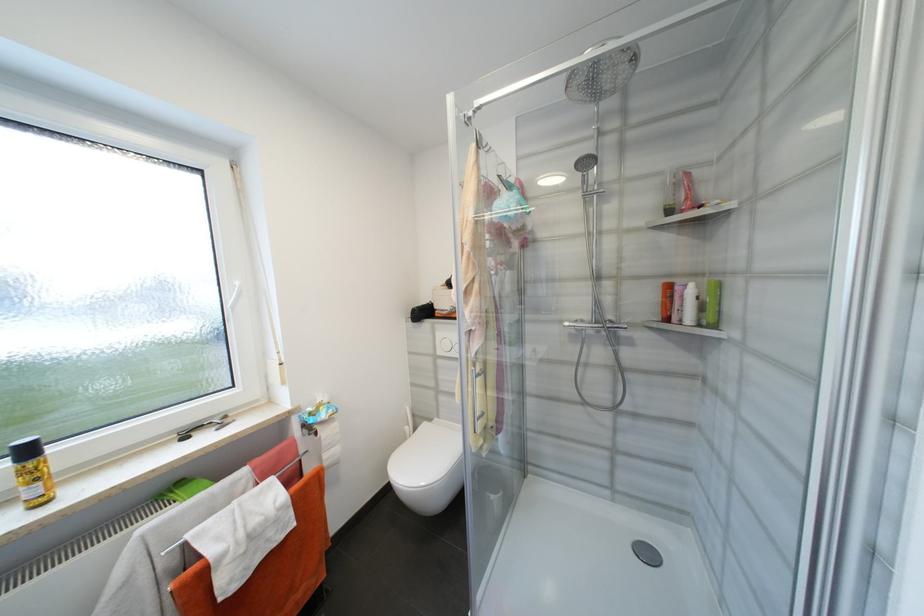
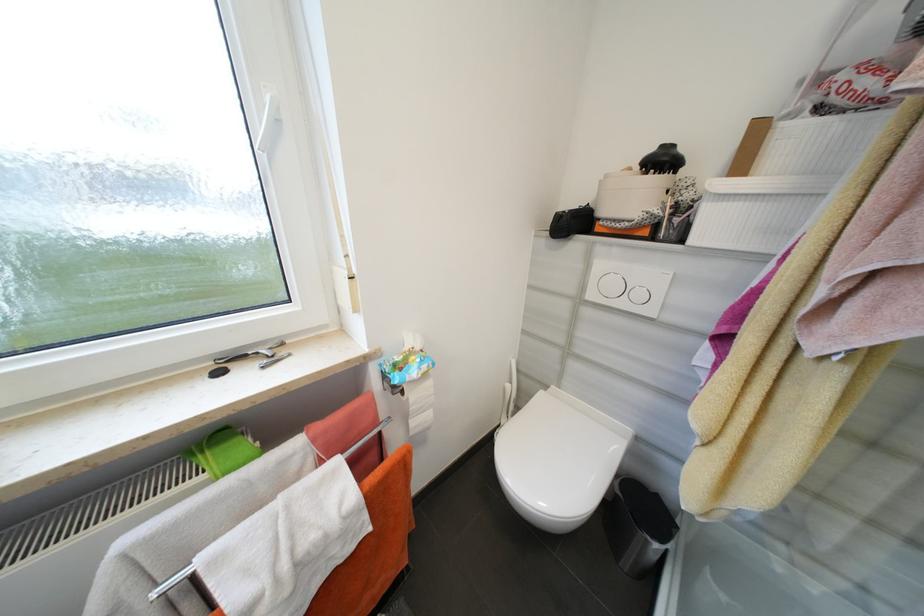
Find the pixel in the second image that matches the point at 412,429 in the first image.

(514, 387)